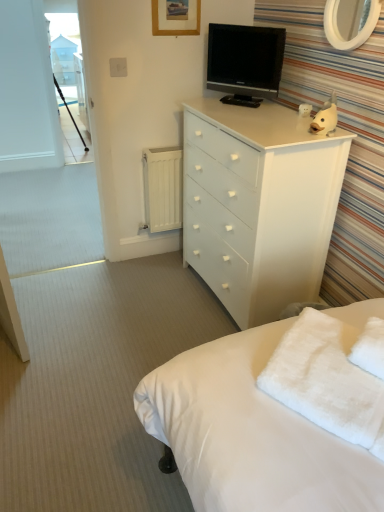
Question: Is white fluffy towel at lower right not close to white glossy chest of drawers at upper right?

Choices:
 (A) yes
 (B) no

Answer: (B)

Question: Considering the relative positions of white fluffy towel at lower right and white glossy chest of drawers at upper right in the image provided, is white fluffy towel at lower right to the left of white glossy chest of drawers at upper right from the viewer's perspective?

Choices:
 (A) yes
 (B) no

Answer: (B)

Question: Does white fluffy towel at lower right appear on the right side of white glossy chest of drawers at upper right?

Choices:
 (A) no
 (B) yes

Answer: (B)

Question: Does white fluffy towel at lower right have a larger size compared to white glossy chest of drawers at upper right?

Choices:
 (A) no
 (B) yes

Answer: (A)

Question: Is white glossy chest of drawers at upper right at the back of white fluffy towel at lower right?

Choices:
 (A) yes
 (B) no

Answer: (B)

Question: Is white fluffy towel at lower right taller than white glossy chest of drawers at upper right?

Choices:
 (A) no
 (B) yes

Answer: (A)

Question: Is white glossy mirror at upper right aimed at white glossy chest of drawers at upper right?

Choices:
 (A) no
 (B) yes

Answer: (A)

Question: Is white glossy chest of drawers at upper right completely or partially inside white glossy mirror at upper right?

Choices:
 (A) no
 (B) yes

Answer: (A)

Question: Is the depth of white glossy mirror at upper right greater than that of white glossy chest of drawers at upper right?

Choices:
 (A) no
 (B) yes

Answer: (A)

Question: Is white glossy mirror at upper right thinner than white glossy chest of drawers at upper right?

Choices:
 (A) no
 (B) yes

Answer: (B)

Question: Does white glossy mirror at upper right appear on the left side of white glossy chest of drawers at upper right?

Choices:
 (A) no
 (B) yes

Answer: (A)

Question: Considering the relative sizes of white glossy mirror at upper right and white glossy chest of drawers at upper right in the image provided, is white glossy mirror at upper right wider than white glossy chest of drawers at upper right?

Choices:
 (A) yes
 (B) no

Answer: (B)

Question: Does white glossy mirror at upper right have a lesser width compared to black glossy tv at upper center?

Choices:
 (A) no
 (B) yes

Answer: (B)